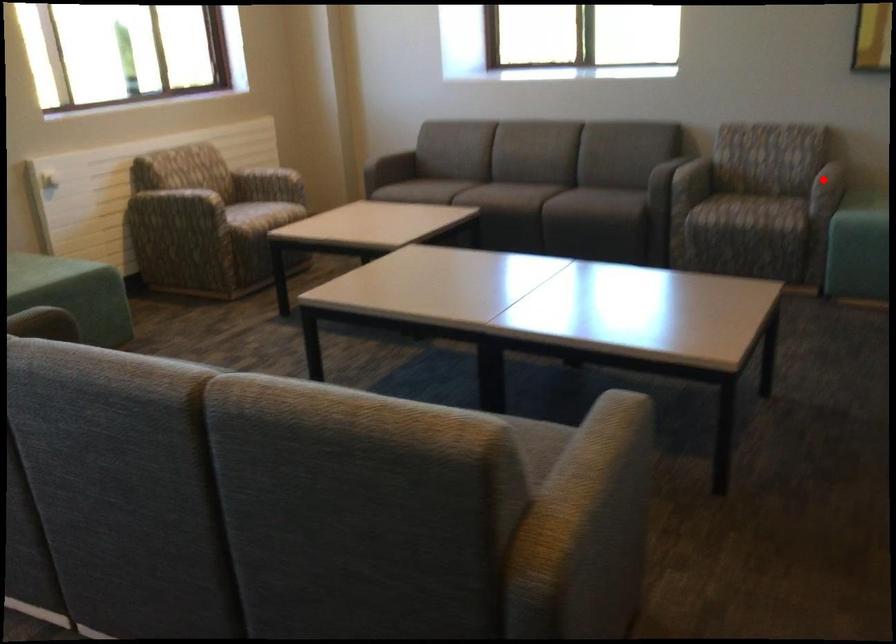
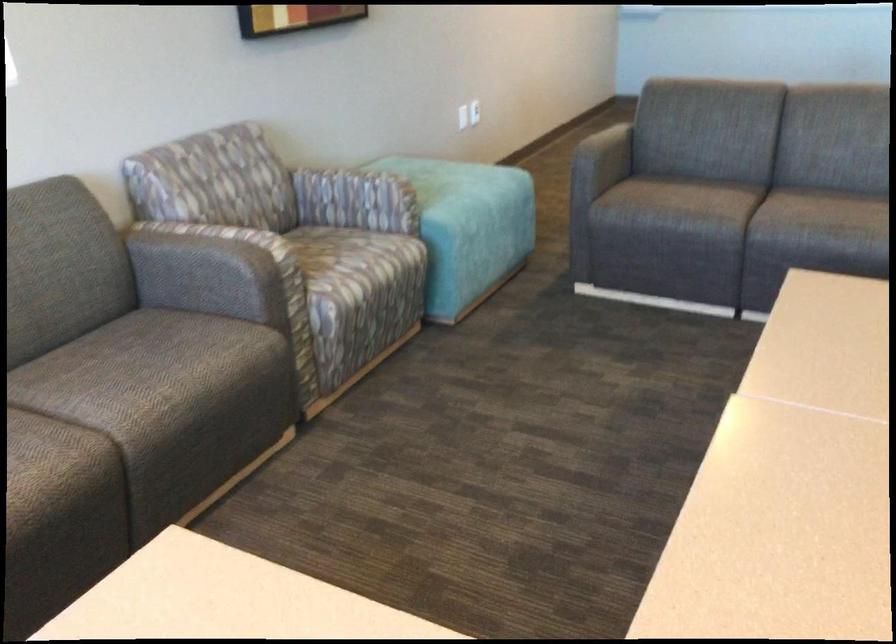
Question: I am providing you with two images of the same scene from different viewpoints. A red point is marked on the first image. Is the red point's position out of view in image 2?

Choices:
 (A) Yes
 (B) No

Answer: (A)